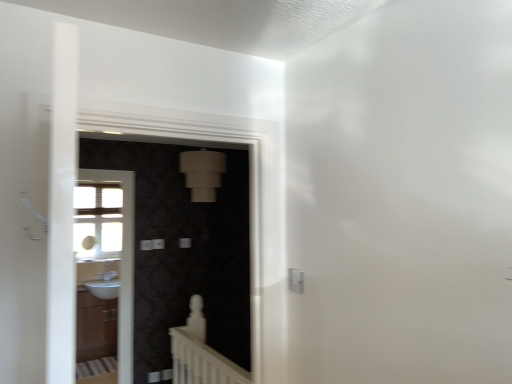
Question: Is white glossy sink at left, marked as the first screen door in a left-to-right arrangement, in front of or behind matte brown cabinet at lower left in the image?

Choices:
 (A) front
 (B) behind

Answer: (A)

Question: From their relative heights in the image, would you say white glossy sink at left, placed as the 2th screen door when sorted from right to left, is taller or shorter than matte brown cabinet at lower left?

Choices:
 (A) short
 (B) tall

Answer: (B)

Question: Estimate the real-world distances between objects in this image. Which object is closer to the white matte balustrade at lower center?

Choices:
 (A) white glossy sink at left, marked as the first screen door in a left-to-right arrangement
 (B) matte brown cabinet at lower left
 (C) white glossy sink at lower left
 (D) matte black screen door at center, the 2th screen door positioned from the back

Answer: (B)

Question: Which is nearer to the white glossy sink at lower left?

Choices:
 (A) white matte balustrade at lower center
 (B) matte brown cabinet at lower left
 (C) white glossy sink at left, placed as the 2th screen door when sorted from right to left
 (D) matte black screen door at center, the 2th screen door positioned from the back

Answer: (B)